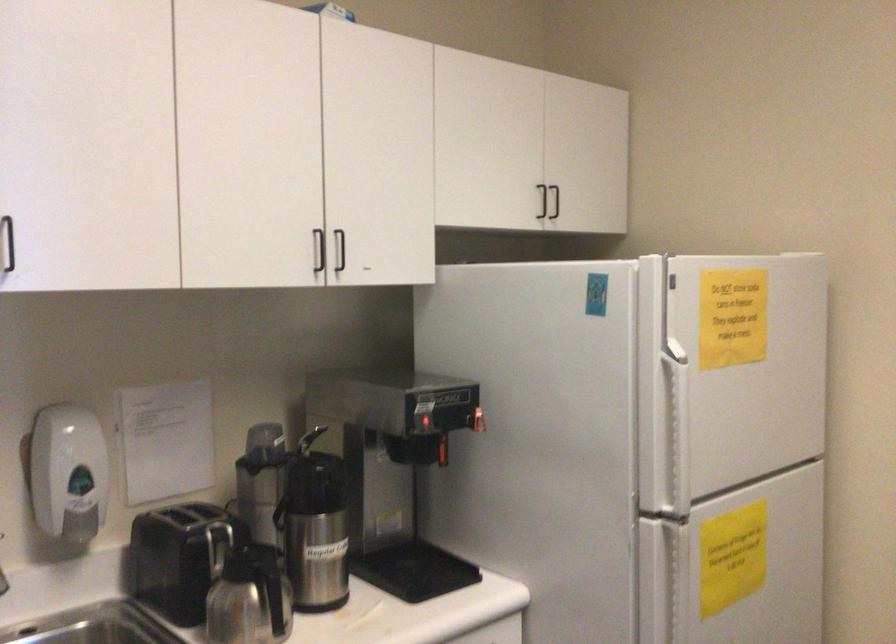
At what (x,y) coordinates should I click in order to perform the action: click on sink faucet handle. Please return your answer as a coordinate pair (x, y). This screenshot has height=644, width=896. Looking at the image, I should click on (308, 440).